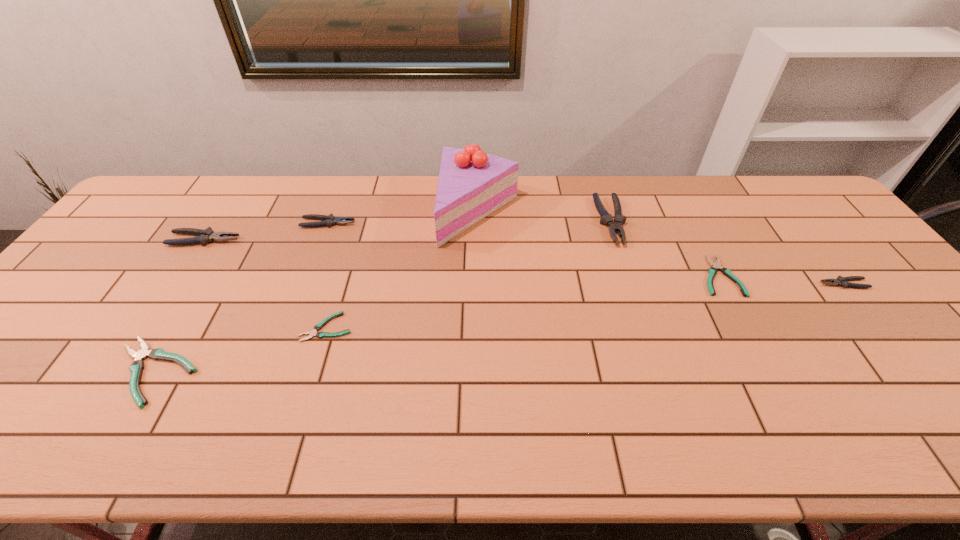
The height and width of the screenshot is (540, 960). Find the location of `the leftmost teal pliers`. the leftmost teal pliers is located at coordinates (137, 366).

The width and height of the screenshot is (960, 540). Find the location of `the sixth tallest object`. the sixth tallest object is located at coordinates (137, 366).

Identify the location of the second object from right to left. The height and width of the screenshot is (540, 960). (712, 271).

Locate an element on the screen. The width and height of the screenshot is (960, 540). the sixth tallest pliers is located at coordinates (712, 271).

Identify the location of the second teal pliers from right to left. (318, 326).

The image size is (960, 540). What are the coordinates of `the shortest pliers` in the screenshot? It's located at (318, 326).

Image resolution: width=960 pixels, height=540 pixels. Find the location of `vacant space located on the front of the cake`. vacant space located on the front of the cake is located at coordinates (479, 283).

Where is `vacant region located 0.230m at the gripping part of the biggest gray pliers`? vacant region located 0.230m at the gripping part of the biggest gray pliers is located at coordinates (639, 308).

Where is `vacant space located 0.070m at the gripping part of the third tallest object`? Image resolution: width=960 pixels, height=540 pixels. vacant space located 0.070m at the gripping part of the third tallest object is located at coordinates (263, 240).

This screenshot has height=540, width=960. Identify the location of vacant space located at the gripping part of the third biggest gray pliers. (454, 223).